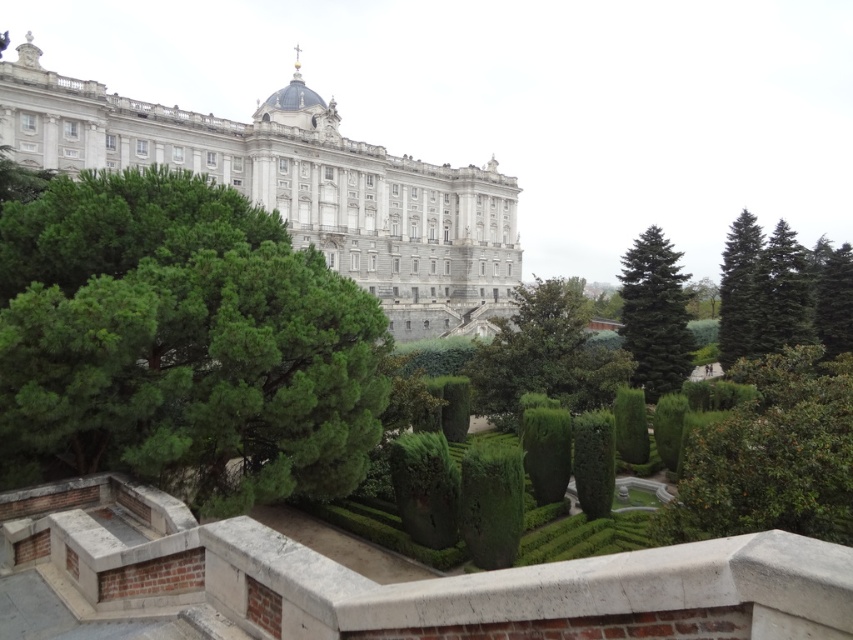
Question: Does green leafy bush at center-right have a lesser width compared to dark green coniferous tree at center-right?

Choices:
 (A) no
 (B) yes

Answer: (A)

Question: Among these objects, which one is farthest from the camera?

Choices:
 (A) green textured pine tree at right
 (B) white marble palace at upper center
 (C) green leafy bush at center-right

Answer: (A)

Question: Which of these objects is positioned closest to the green textured tree at upper right?

Choices:
 (A) white marble palace at upper center
 (B) green leafy tree at left
 (C) green leafy tree at center

Answer: (C)

Question: Does green fir tree at right have a lesser width compared to green textured pine tree at right?

Choices:
 (A) no
 (B) yes

Answer: (A)

Question: Which object is closer to the camera taking this photo?

Choices:
 (A) green leafy tree at left
 (B) green fir tree at right

Answer: (A)

Question: From the image, what is the correct spatial relationship of green leafy bush at center-right in relation to green textured tree at upper right?

Choices:
 (A) left
 (B) right

Answer: (A)